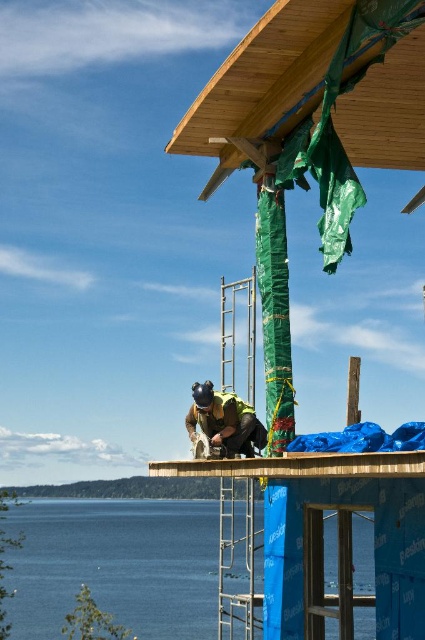
You are a safety inspector observing the construction site. You notice the blue water at lower left and the green safety vest at center. According to safety regulations, the water level must not exceed the height of the safety vest. Is there a potential hazard here?

The blue water at lower left is taller than the green safety vest at center, which means the water level exceeds the safety vest height. This creates a potential hazard requiring immediate attention.

You are a construction worker standing at the center of the wooden structure. You need to locate the blue water at lower left. According to the coordinates provided, where exactly should you look to find it?

The blue water at lower left is located at coordinates point (x=116, y=564), so you should look towards the lower left direction at that specific coordinate point to find it.

Based on the scene described, can you determine if the natural wood roof at upper center is wider than the green safety vest at center?

The natural wood roof at upper center is wider than the green safety vest at center, as stated in the description.